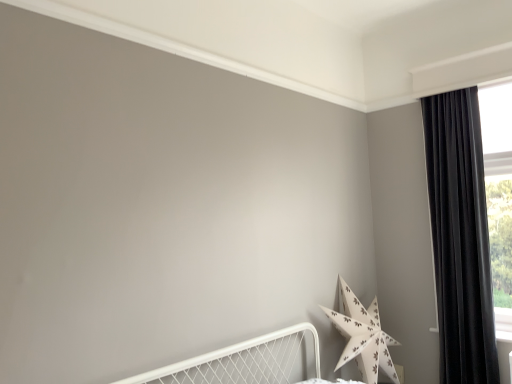
The height and width of the screenshot is (384, 512). What do you see at coordinates (460, 237) in the screenshot?
I see `black velvet curtain at right` at bounding box center [460, 237].

Locate an element on the screen. The width and height of the screenshot is (512, 384). black velvet curtain at right is located at coordinates (460, 237).

Find the location of `white paper star at lower right`. white paper star at lower right is located at coordinates point(362,336).

The height and width of the screenshot is (384, 512). Describe the element at coordinates (362, 336) in the screenshot. I see `white paper star at lower right` at that location.

Locate an element on the screen. The height and width of the screenshot is (384, 512). black velvet curtain at right is located at coordinates 460,237.

Considering the positions of objects black velvet curtain at right and white paper star at lower right in the image provided, who is more to the right, black velvet curtain at right or white paper star at lower right?

Positioned to the right is black velvet curtain at right.

Which object is more forward, black velvet curtain at right or white paper star at lower right?

white paper star at lower right.

Considering the positions of point (442, 100) and point (350, 340), is point (442, 100) closer or farther from the camera than point (350, 340)?

Point (442, 100) appears to be farther away from the viewer than point (350, 340).

From the image's perspective, would you say black velvet curtain at right is positioned over white paper star at lower right?

Yes, from the image's perspective, black velvet curtain at right is over white paper star at lower right.

From a real-world perspective, relative to white paper star at lower right, is black velvet curtain at right vertically above or below?

In terms of real-world spatial position, black velvet curtain at right is above white paper star at lower right.

Considering the relative sizes of black velvet curtain at right and white paper star at lower right in the image provided, is black velvet curtain at right wider than white paper star at lower right?

Incorrect, the width of black velvet curtain at right does not surpass that of white paper star at lower right.

Between black velvet curtain at right and white paper star at lower right, which one has more height?

Standing taller between the two is black velvet curtain at right.

Does black velvet curtain at right have a smaller size compared to white paper star at lower right?

Yes.

Is black velvet curtain at right outside of white paper star at lower right?

Yes, black velvet curtain at right is not within white paper star at lower right.

Are black velvet curtain at right and white paper star at lower right making contact?

There is a gap between black velvet curtain at right and white paper star at lower right.

Is black velvet curtain at right aimed at white paper star at lower right?

Answer: No, black velvet curtain at right does not turn towards white paper star at lower right.

Measure the distance from black velvet curtain at right to white paper star at lower right.

black velvet curtain at right is 30.19 inches from white paper star at lower right.

Where is `curtain that is behind the white paper star at lower right`? This screenshot has width=512, height=384. curtain that is behind the white paper star at lower right is located at coordinates (460, 237).

Between white paper star at lower right and black velvet curtain at right, which one appears on the right side from the viewer's perspective?

From the viewer's perspective, black velvet curtain at right appears more on the right side.

Considering the positions of objects white paper star at lower right and black velvet curtain at right in the image provided, who is in front, white paper star at lower right or black velvet curtain at right?

white paper star at lower right is in front.

Is point (372, 356) less distant than point (447, 96)?

Yes.

From the image's perspective, relative to black velvet curtain at right, is white paper star at lower right above or below?

white paper star at lower right is situated lower than black velvet curtain at right in the image.

From a real-world perspective, is white paper star at lower right positioned above or below black velvet curtain at right?

white paper star at lower right is situated lower than black velvet curtain at right in the real world.

Which of these two, white paper star at lower right or black velvet curtain at right, is thinner?

With smaller width is black velvet curtain at right.

Based on the photo, considering the sizes of objects white paper star at lower right and black velvet curtain at right in the image provided, who is taller, white paper star at lower right or black velvet curtain at right?

Standing taller between the two is black velvet curtain at right.

Who is smaller, white paper star at lower right or black velvet curtain at right?

black velvet curtain at right.

Do you think white paper star at lower right is within black velvet curtain at right, or outside of it?

white paper star at lower right exists outside the volume of black velvet curtain at right.

Based on the photo, is white paper star at lower right directly adjacent to black velvet curtain at right?

white paper star at lower right and black velvet curtain at right are clearly separated.

Is white paper star at lower right facing away from black velvet curtain at right?

No.

Consider the image. Can you tell me how much white paper star at lower right and black velvet curtain at right differ in facing direction?

The angular difference between white paper star at lower right and black velvet curtain at right is 87.8 degrees.

How much distance is there between white paper star at lower right and black velvet curtain at right?

white paper star at lower right and black velvet curtain at right are 30.19 inches apart.

Identify the location of star in front of the black velvet curtain at right. The height and width of the screenshot is (384, 512). (362, 336).

You are a GUI agent. You are given a task and a screenshot of the screen. Output one action in this format:
    pyautogui.click(x=<x>, y=<y>)
    Task: Click on the curtain lying behind the white paper star at lower right
    
    Given the screenshot: What is the action you would take?
    pyautogui.click(x=460, y=237)

Locate an element on the screen. curtain positioned vertically above the white paper star at lower right (from a real-world perspective) is located at coordinates (460, 237).